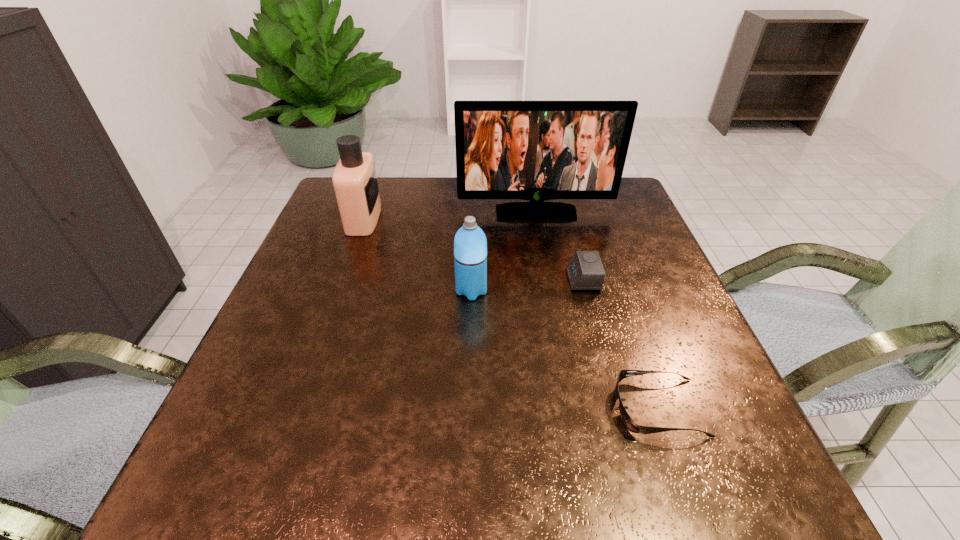
Find the location of a particular element. Image resolution: width=960 pixels, height=540 pixels. vacant region between the shortest object and the alarm clock is located at coordinates (621, 343).

Find the location of a particular element. unoccupied position between the shortest object and the tallest object is located at coordinates (597, 310).

Locate an element on the screen. unoccupied position between the sunglasses and the tallest object is located at coordinates (597, 310).

At what (x,y) coordinates should I click in order to perform the action: click on empty location between the shortest object and the second shortest object. Please return your answer as a coordinate pair (x, y). Looking at the image, I should click on (621, 343).

You are a GUI agent. You are given a task and a screenshot of the screen. Output one action in this format:
    pyautogui.click(x=<x>, y=<y>)
    Task: Click on the free spot between the tallest object and the alarm clock
    
    Given the screenshot: What is the action you would take?
    pyautogui.click(x=560, y=246)

Where is `free space that is in between the thermos bottle and the tallest object`? The image size is (960, 540). free space that is in between the thermos bottle and the tallest object is located at coordinates (503, 252).

Locate an element on the screen. The height and width of the screenshot is (540, 960). free spot between the thermos bottle and the perfume is located at coordinates (418, 255).

I want to click on vacant area between the monitor and the sunglasses, so click(x=597, y=310).

The width and height of the screenshot is (960, 540). Find the location of `blank region between the second shortest object and the monitor`. blank region between the second shortest object and the monitor is located at coordinates (560, 246).

Find the location of a particular element. This screenshot has height=540, width=960. vacant area between the perfume and the third tallest object is located at coordinates (418, 255).